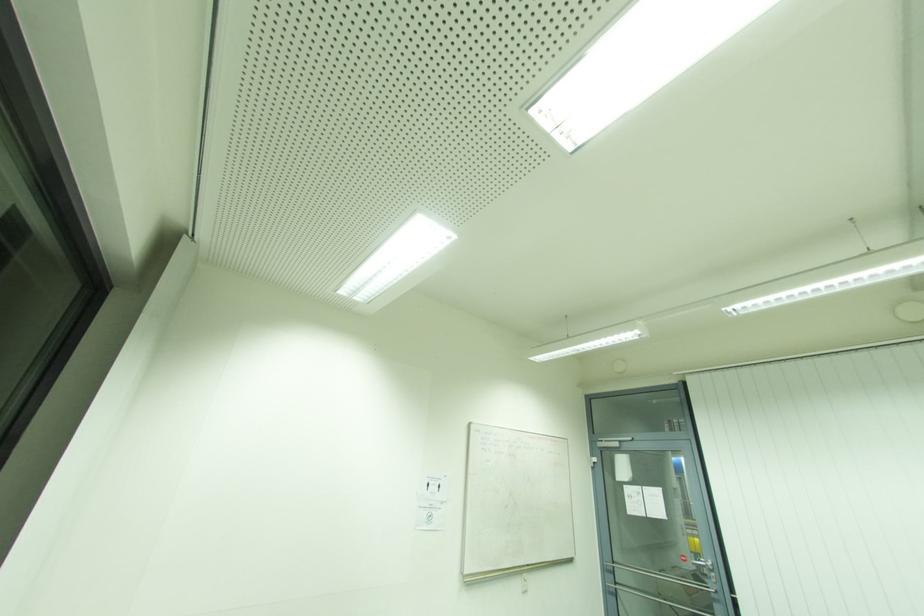
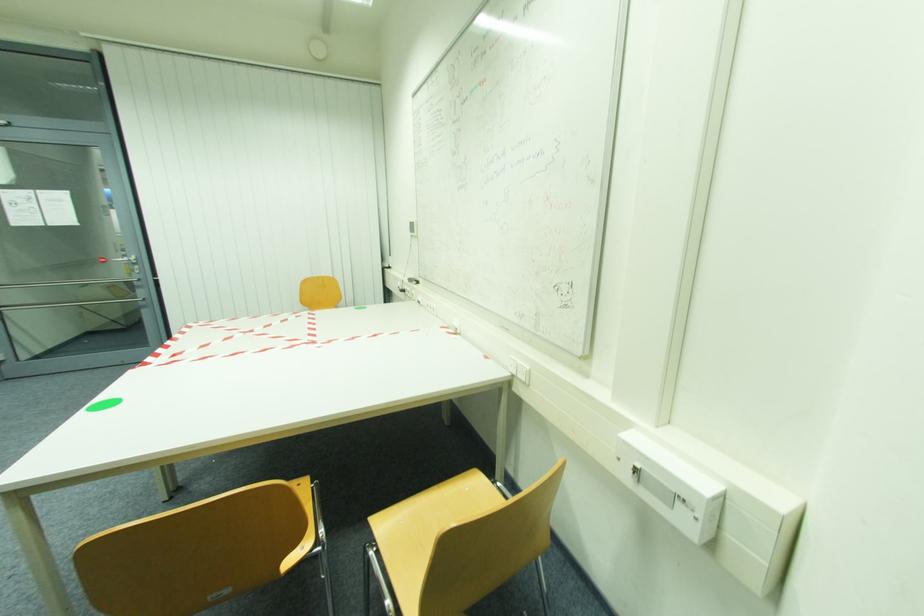
The images are taken continuously from a first-person perspective. In which direction is your viewpoint rotating?

The rotation direction of the camera is right-down.